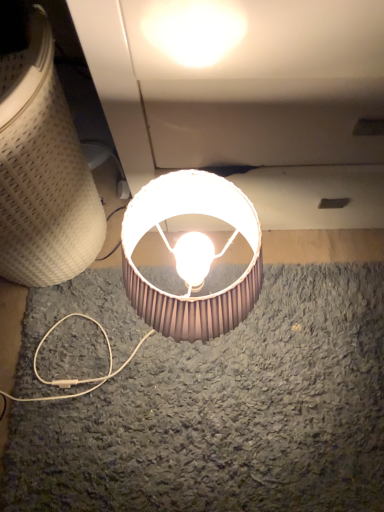
Where is `matte brown lampshade at lower center, marked as the 1th lamp in a left-to-right arrangement`? The image size is (384, 512). matte brown lampshade at lower center, marked as the 1th lamp in a left-to-right arrangement is located at coordinates (43, 170).

Describe the element at coordinates (43, 170) in the screenshot. The image size is (384, 512). I see `matte brown lampshade at lower center, acting as the second lamp starting from the right` at that location.

The image size is (384, 512). What do you see at coordinates (183, 214) in the screenshot? I see `brown pleated lampshade at center, which is the 1th lamp from right to left` at bounding box center [183, 214].

Where is `brown pleated lampshade at center, which is the 1th lamp from right to left`? Image resolution: width=384 pixels, height=512 pixels. brown pleated lampshade at center, which is the 1th lamp from right to left is located at coordinates (183, 214).

The width and height of the screenshot is (384, 512). Identify the location of matte brown lampshade at lower center, marked as the 1th lamp in a left-to-right arrangement. (43, 170).

In the image, is brown pleated lampshade at center, arranged as the second lamp when viewed from the left, on the left side or the right side of matte brown lampshade at lower center, marked as the 1th lamp in a left-to-right arrangement?

Clearly, brown pleated lampshade at center, arranged as the second lamp when viewed from the left, is on the right of matte brown lampshade at lower center, marked as the 1th lamp in a left-to-right arrangement, in the image.

Is brown pleated lampshade at center, which is the 1th lamp from right to left, closer to camera compared to matte brown lampshade at lower center, marked as the 1th lamp in a left-to-right arrangement?

No, brown pleated lampshade at center, which is the 1th lamp from right to left, is further to the viewer.

Considering the positions of points (145, 312) and (68, 176), is point (145, 312) closer to camera compared to point (68, 176)?

Yes, point (145, 312) is in front of point (68, 176).

From the image's perspective, who appears lower, brown pleated lampshade at center, which is the 1th lamp from right to left, or matte brown lampshade at lower center, acting as the second lamp starting from the right?

brown pleated lampshade at center, which is the 1th lamp from right to left, from the image's perspective.

In the scene shown: From a real-world perspective, is brown pleated lampshade at center, which is the 1th lamp from right to left, over matte brown lampshade at lower center, acting as the second lamp starting from the right?

Actually, brown pleated lampshade at center, which is the 1th lamp from right to left, is physically below matte brown lampshade at lower center, acting as the second lamp starting from the right, in the real world.

Consider the image. Between brown pleated lampshade at center, which is the 1th lamp from right to left, and matte brown lampshade at lower center, acting as the second lamp starting from the right, which one has larger width?

With larger width is matte brown lampshade at lower center, acting as the second lamp starting from the right.

Considering the sizes of brown pleated lampshade at center, arranged as the second lamp when viewed from the left, and matte brown lampshade at lower center, marked as the 1th lamp in a left-to-right arrangement, in the image, is brown pleated lampshade at center, arranged as the second lamp when viewed from the left, taller or shorter than matte brown lampshade at lower center, marked as the 1th lamp in a left-to-right arrangement,?

brown pleated lampshade at center, arranged as the second lamp when viewed from the left, is shorter than matte brown lampshade at lower center, marked as the 1th lamp in a left-to-right arrangement.

Considering the sizes of brown pleated lampshade at center, which is the 1th lamp from right to left, and matte brown lampshade at lower center, acting as the second lamp starting from the right, in the image, is brown pleated lampshade at center, which is the 1th lamp from right to left, bigger or smaller than matte brown lampshade at lower center, acting as the second lamp starting from the right,?

Considering their sizes, brown pleated lampshade at center, which is the 1th lamp from right to left, takes up less space than matte brown lampshade at lower center, acting as the second lamp starting from the right.

Is matte brown lampshade at lower center, marked as the 1th lamp in a left-to-right arrangement, completely or partially inside brown pleated lampshade at center, arranged as the second lamp when viewed from the left?

No, matte brown lampshade at lower center, marked as the 1th lamp in a left-to-right arrangement, is not a part of brown pleated lampshade at center, arranged as the second lamp when viewed from the left.

Is brown pleated lampshade at center, which is the 1th lamp from right to left, not close to matte brown lampshade at lower center, marked as the 1th lamp in a left-to-right arrangement?

No, brown pleated lampshade at center, which is the 1th lamp from right to left, is not far from matte brown lampshade at lower center, marked as the 1th lamp in a left-to-right arrangement.

Is brown pleated lampshade at center, arranged as the second lamp when viewed from the left, oriented towards matte brown lampshade at lower center, acting as the second lamp starting from the right?

No, brown pleated lampshade at center, arranged as the second lamp when viewed from the left, is not oriented towards matte brown lampshade at lower center, acting as the second lamp starting from the right.

How different are the orientations of brown pleated lampshade at center, arranged as the second lamp when viewed from the left, and matte brown lampshade at lower center, acting as the second lamp starting from the right, in degrees?

The angle between the facing direction of brown pleated lampshade at center, arranged as the second lamp when viewed from the left, and the facing direction of matte brown lampshade at lower center, acting as the second lamp starting from the right, is 0.742 degrees.

This screenshot has width=384, height=512. What are the coordinates of `lamp above the brown pleated lampshade at center, arranged as the second lamp when viewed from the left (from a real-world perspective)` in the screenshot? It's located at (43, 170).

Which object is positioned more to the right, matte brown lampshade at lower center, acting as the second lamp starting from the right, or brown pleated lampshade at center, which is the 1th lamp from right to left?

Positioned to the right is brown pleated lampshade at center, which is the 1th lamp from right to left.

From the picture: Between matte brown lampshade at lower center, acting as the second lamp starting from the right, and brown pleated lampshade at center, which is the 1th lamp from right to left, which one is positioned behind?

brown pleated lampshade at center, which is the 1th lamp from right to left, is further from the camera.

Is point (42, 167) positioned in front of point (128, 222)?

Yes, point (42, 167) is closer to viewer.

From the image's perspective, which is below, matte brown lampshade at lower center, marked as the 1th lamp in a left-to-right arrangement, or brown pleated lampshade at center, which is the 1th lamp from right to left?

brown pleated lampshade at center, which is the 1th lamp from right to left, from the image's perspective.

From a real-world perspective, who is located higher, matte brown lampshade at lower center, acting as the second lamp starting from the right, or brown pleated lampshade at center, arranged as the second lamp when viewed from the left?

In real-world perspective, matte brown lampshade at lower center, acting as the second lamp starting from the right, is above.

Can you confirm if matte brown lampshade at lower center, acting as the second lamp starting from the right, is wider than brown pleated lampshade at center, which is the 1th lamp from right to left?

Correct, the width of matte brown lampshade at lower center, acting as the second lamp starting from the right, exceeds that of brown pleated lampshade at center, which is the 1th lamp from right to left.

Is matte brown lampshade at lower center, acting as the second lamp starting from the right, taller or shorter than brown pleated lampshade at center, arranged as the second lamp when viewed from the left?

Clearly, matte brown lampshade at lower center, acting as the second lamp starting from the right, is taller compared to brown pleated lampshade at center, arranged as the second lamp when viewed from the left.

Does matte brown lampshade at lower center, marked as the 1th lamp in a left-to-right arrangement, have a larger size compared to brown pleated lampshade at center, arranged as the second lamp when viewed from the left?

Correct, matte brown lampshade at lower center, marked as the 1th lamp in a left-to-right arrangement, is larger in size than brown pleated lampshade at center, arranged as the second lamp when viewed from the left.

Would you say matte brown lampshade at lower center, acting as the second lamp starting from the right, is inside or outside brown pleated lampshade at center, which is the 1th lamp from right to left?

matte brown lampshade at lower center, acting as the second lamp starting from the right, lies outside brown pleated lampshade at center, which is the 1th lamp from right to left.

Would you consider matte brown lampshade at lower center, marked as the 1th lamp in a left-to-right arrangement, to be distant from brown pleated lampshade at center, which is the 1th lamp from right to left?

matte brown lampshade at lower center, marked as the 1th lamp in a left-to-right arrangement, is actually quite close to brown pleated lampshade at center, which is the 1th lamp from right to left.

Could you tell me if matte brown lampshade at lower center, marked as the 1th lamp in a left-to-right arrangement, is facing brown pleated lampshade at center, which is the 1th lamp from right to left?

No.

How different are the orientations of matte brown lampshade at lower center, acting as the second lamp starting from the right, and brown pleated lampshade at center, arranged as the second lamp when viewed from the left, in degrees?

0.742 degrees separate the facing orientations of matte brown lampshade at lower center, acting as the second lamp starting from the right, and brown pleated lampshade at center, arranged as the second lamp when viewed from the left.

Measure the distance between matte brown lampshade at lower center, acting as the second lamp starting from the right, and brown pleated lampshade at center, which is the 1th lamp from right to left.

They are 9.92 inches apart.

Where is `lamp that appears above the brown pleated lampshade at center, which is the 1th lamp from right to left (from the image's perspective)`? The image size is (384, 512). lamp that appears above the brown pleated lampshade at center, which is the 1th lamp from right to left (from the image's perspective) is located at coordinates (43, 170).

Where is `lamp located above the brown pleated lampshade at center, arranged as the second lamp when viewed from the left (from the image's perspective)`? lamp located above the brown pleated lampshade at center, arranged as the second lamp when viewed from the left (from the image's perspective) is located at coordinates (43, 170).

Find the location of a particular element. The image size is (384, 512). lamp that appears on the left of brown pleated lampshade at center, arranged as the second lamp when viewed from the left is located at coordinates (43, 170).